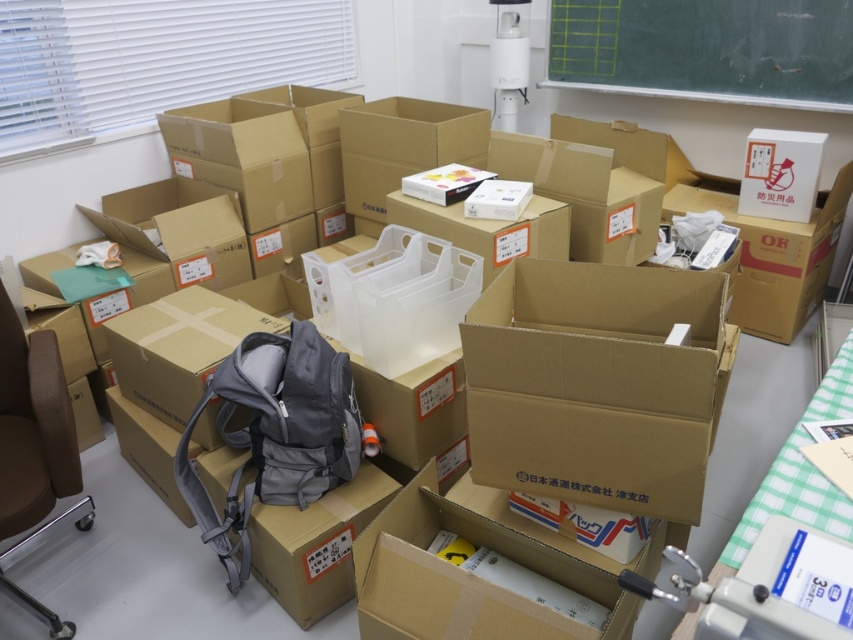
You are trying to navigate through the cluttered indoor space filled with cardboard boxes. There is a gray backpack on a box and a brown leather swivel chair at left. Which object is closer to the entrance if you assume the entrance is at the bottom left corner of the image?

The brown leather swivel chair at left is closer to the entrance because its coordinates at point (32, 426) place it near the bottom left corner of the image, which is where the entrance is assumed to be.

You are standing in the cluttered indoor space with boxes everywhere. You see two points marked in the scene, one at coordinate point (259, 332) and the other at point (756, 497). Which point is closer to you?

Point (259, 332) is closer to you because it is further to the camera than point (756, 497).